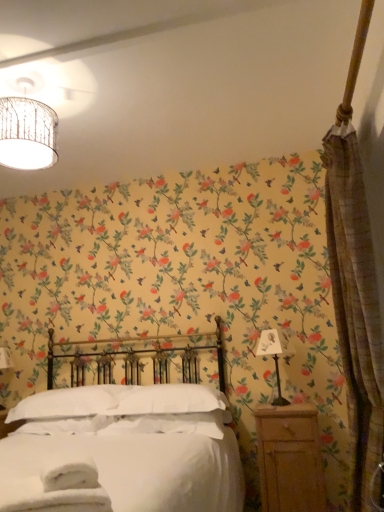
Where is `free area below metallic silver lamp at right (from a real-world perspective)`? free area below metallic silver lamp at right (from a real-world perspective) is located at coordinates (281, 406).